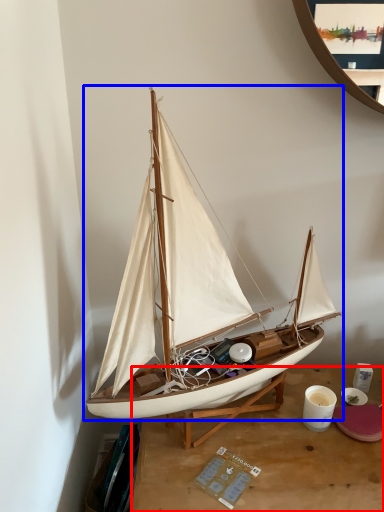
Question: Which object appears closest to the camera in this image, desk (highlighted by a red box) or boat (highlighted by a blue box)?

Choices:
 (A) desk
 (B) boat

Answer: (B)